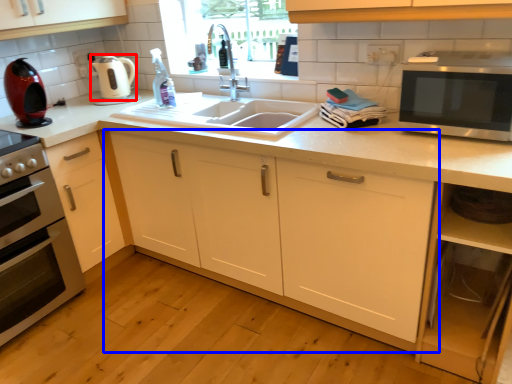
Question: Which object is further to the camera taking this photo, appliance (highlighted by a red box) or cabinetry (highlighted by a blue box)?

Choices:
 (A) appliance
 (B) cabinetry

Answer: (A)